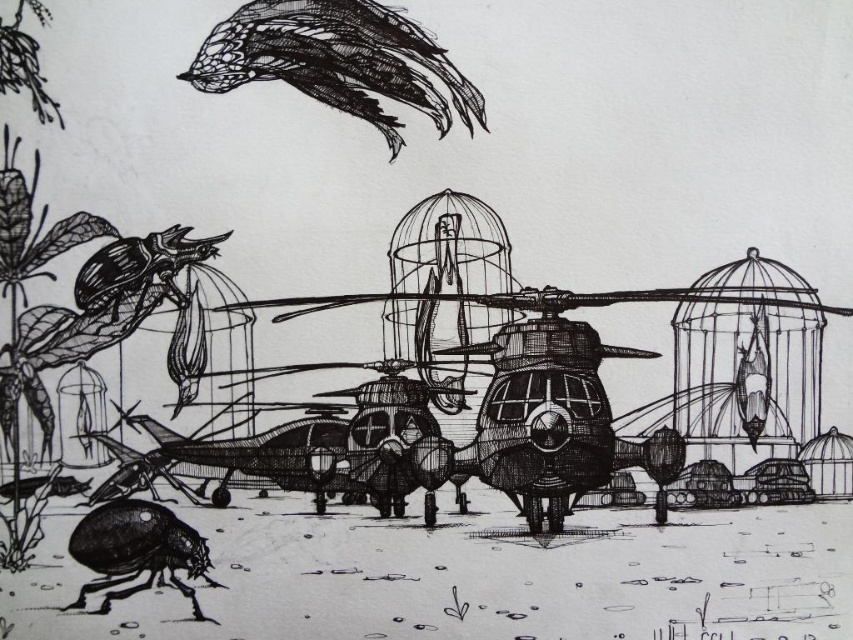
Who is more distant from viewer, (111, 557) or (154, 252)?

The point (154, 252) is behind.

Identify the location of shiny black beetle at lower left. The height and width of the screenshot is (640, 853). (137, 550).